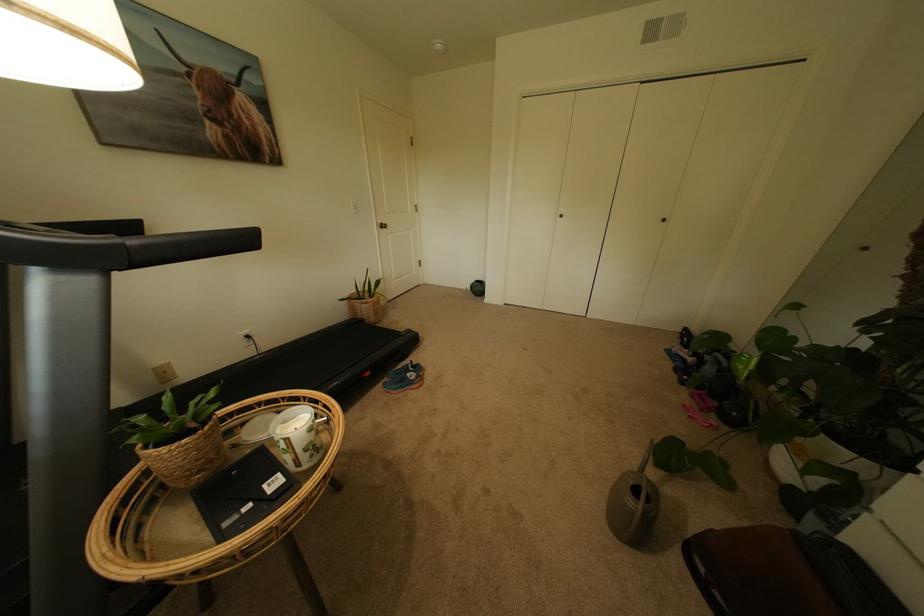
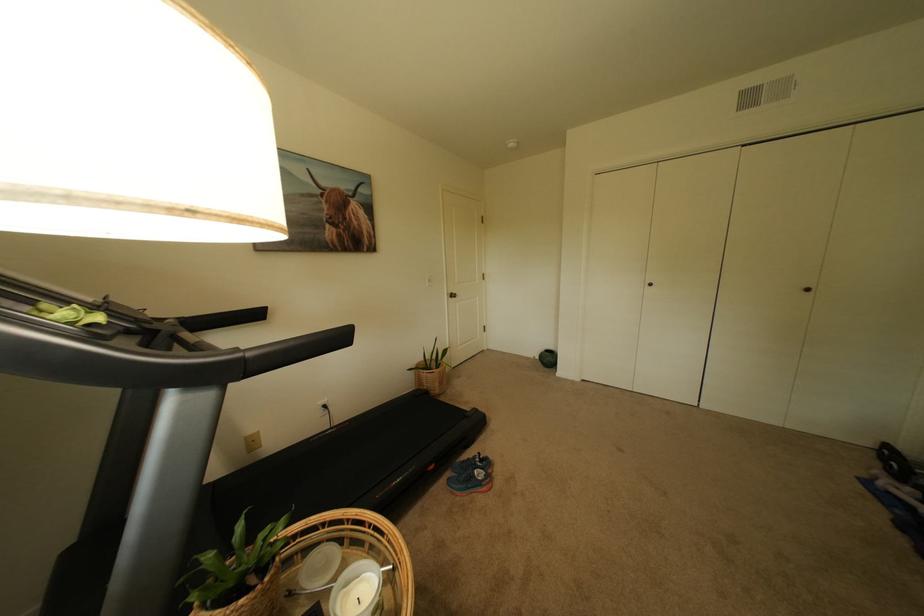
In a continuous first-person perspective shot, in which direction is the camera moving?

The movement direction of the cameraman is left, forward.